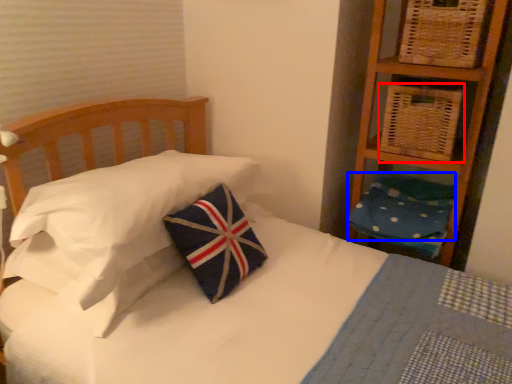
Question: Which point is further to the camera, basket (highlighted by a red box) or pillow (highlighted by a blue box)?

Choices:
 (A) basket
 (B) pillow

Answer: (B)